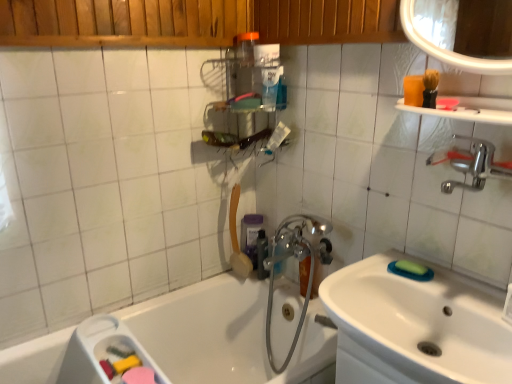
Question: Is the position of metallic silver shelf at upper center less distant than that of matte orange shower head at upper center?

Choices:
 (A) no
 (B) yes

Answer: (B)

Question: From a real-world perspective, is metallic silver shelf at upper center physically above matte orange shower head at upper center?

Choices:
 (A) yes
 (B) no

Answer: (A)

Question: Can you confirm if metallic silver shelf at upper center is smaller than matte orange shower head at upper center?

Choices:
 (A) yes
 (B) no

Answer: (B)

Question: Does metallic silver shelf at upper center appear on the right side of matte orange shower head at upper center?

Choices:
 (A) no
 (B) yes

Answer: (B)

Question: Does metallic silver shelf at upper center have a lesser height compared to matte orange shower head at upper center?

Choices:
 (A) yes
 (B) no

Answer: (A)

Question: Is green sponge at sink inside or outside of white glossy sink at lower right?

Choices:
 (A) inside
 (B) outside

Answer: (A)

Question: Considering the positions of green sponge at sink and white glossy sink at lower right in the image, is green sponge at sink bigger or smaller than white glossy sink at lower right?

Choices:
 (A) small
 (B) big

Answer: (A)

Question: From a real-world perspective, is green sponge at sink above or below white glossy sink at lower right?

Choices:
 (A) below
 (B) above

Answer: (B)

Question: From the image's perspective, is green sponge at sink positioned above or below white glossy sink at lower right?

Choices:
 (A) below
 (B) above

Answer: (B)

Question: Does point (202, 64) appear closer or farther from the camera than point (314, 226)?

Choices:
 (A) farther
 (B) closer

Answer: (A)

Question: Do you think metallic silver shelf at upper center is within chrome metallic faucet at center, or outside of it?

Choices:
 (A) inside
 (B) outside

Answer: (B)

Question: From the image's perspective, is metallic silver shelf at upper center located above or below chrome metallic faucet at center?

Choices:
 (A) above
 (B) below

Answer: (A)

Question: In terms of height, does metallic silver shelf at upper center look taller or shorter compared to chrome metallic faucet at center?

Choices:
 (A) short
 (B) tall

Answer: (A)

Question: From their relative heights in the image, would you say matte orange shower head at upper center is taller or shorter than green sponge at sink?

Choices:
 (A) tall
 (B) short

Answer: (A)

Question: Is matte orange shower head at upper center inside the boundaries of green sponge at sink, or outside?

Choices:
 (A) inside
 (B) outside

Answer: (B)